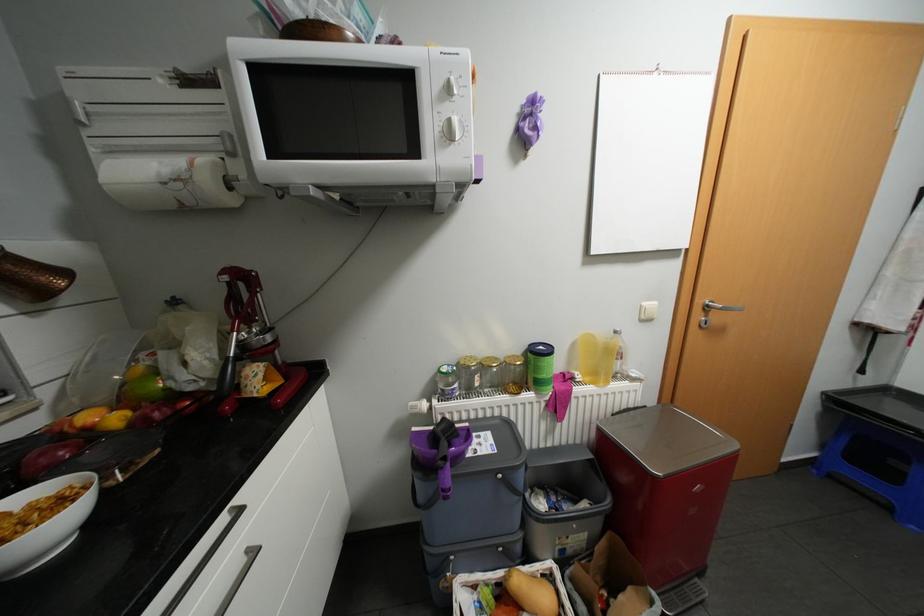
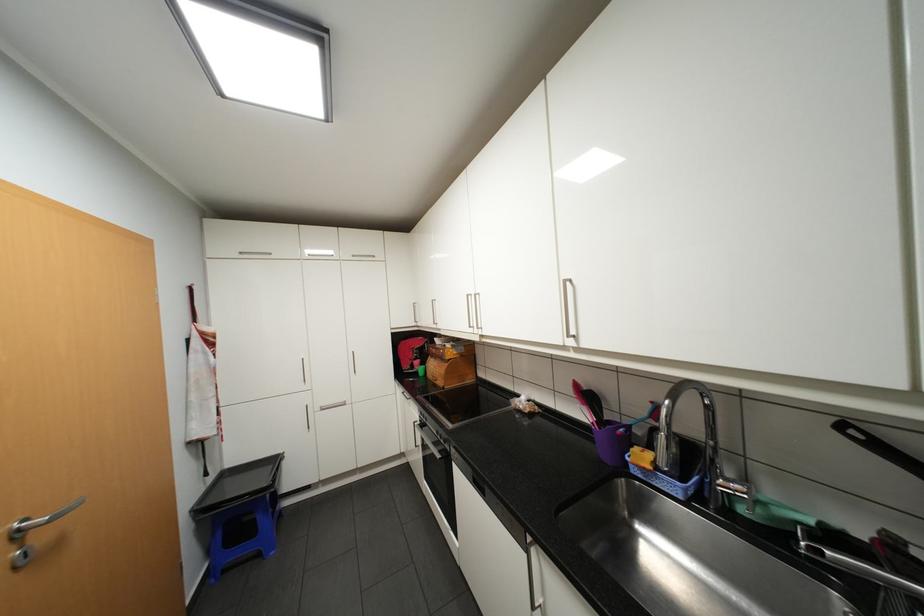
Find the pixel in the second image that matches point 874,379 in the first image.

(220, 476)